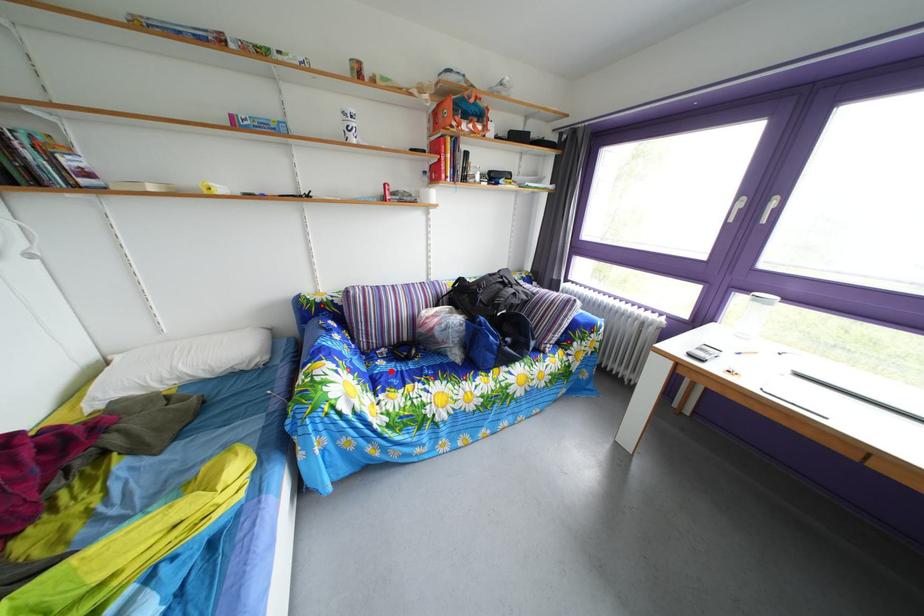
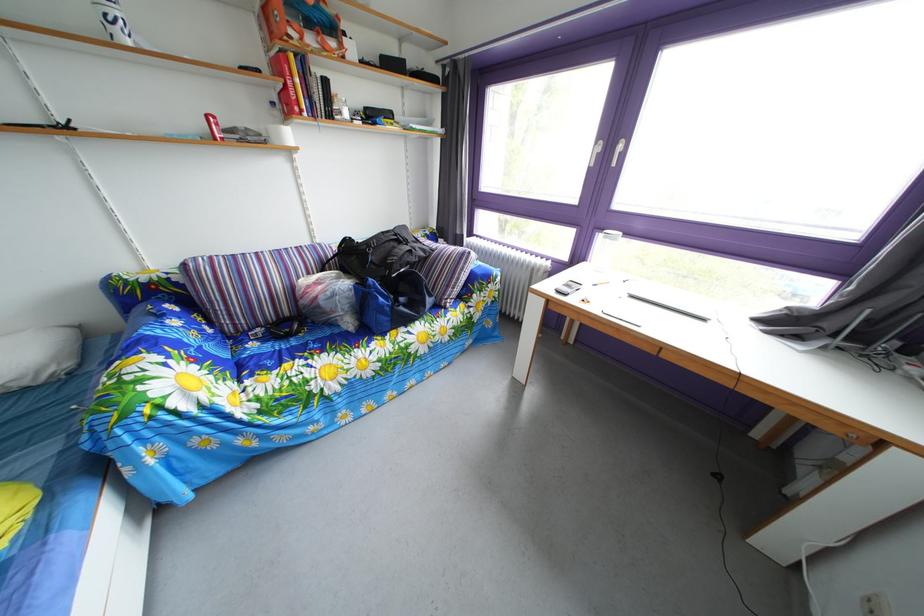
Find the pixel in the second image that matches the highlighted location in the first image.

(262, 353)